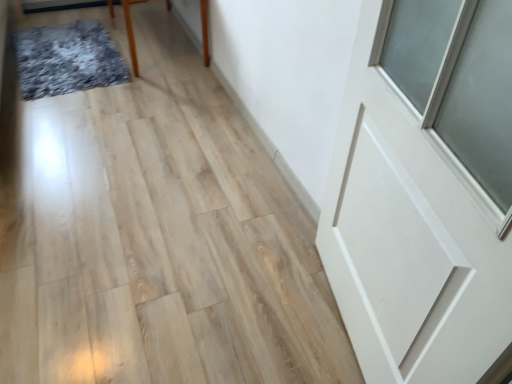
At what (x,y) coordinates should I click in order to perform the action: click on vacant space behind white matte door at upper right. Please return your answer as a coordinate pair (x, y). The height and width of the screenshot is (384, 512). Looking at the image, I should click on (276, 224).